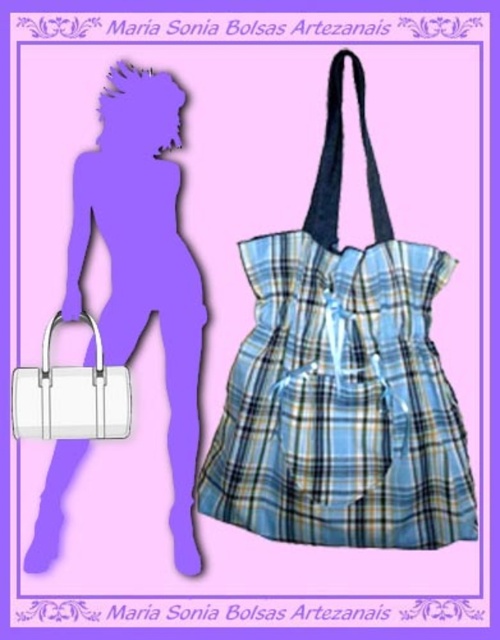
Question: Which point appears farthest from the camera in this image?

Choices:
 (A) (276, 320)
 (B) (109, 77)

Answer: (B)

Question: Which point is farther to the camera?

Choices:
 (A) matte white bag at lower left
 (B) blue plaid fabric dress at center
 (C) white leather handbag at left

Answer: (A)

Question: Which of the following is the closest to the observer?

Choices:
 (A) matte white bag at lower left
 (B) blue plaid fabric dress at center

Answer: (B)

Question: Can you confirm if blue plaid fabric dress at center is positioned above matte white bag at lower left?

Choices:
 (A) yes
 (B) no

Answer: (A)

Question: Is blue plaid fabric dress at center below matte white bag at lower left?

Choices:
 (A) no
 (B) yes

Answer: (A)

Question: Can you confirm if matte white bag at lower left is smaller than white leather handbag at left?

Choices:
 (A) yes
 (B) no

Answer: (B)